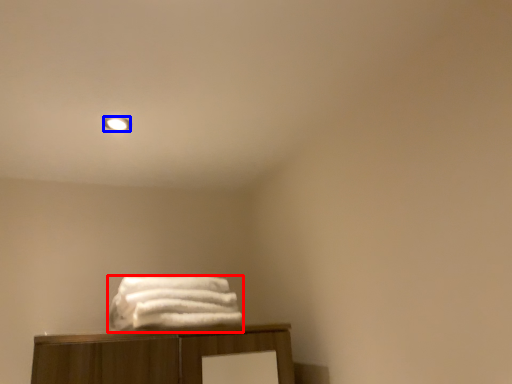
Question: Which object appears farthest to the camera in this image, towel (highlighted by a red box) or lighting (highlighted by a blue box)?

Choices:
 (A) towel
 (B) lighting

Answer: (B)